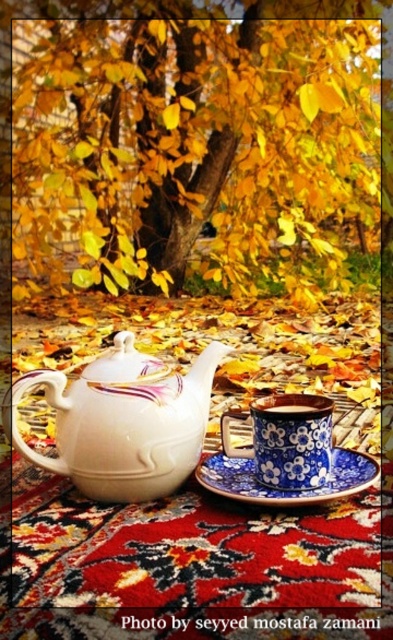
Question: Observing the image, what is the correct spatial positioning of blue ceramic saucer at center in reference to blue glossy mug at center?

Choices:
 (A) left
 (B) right

Answer: (B)

Question: Can you confirm if yellow leaves at upper center is smaller than blue ceramic saucer at center?

Choices:
 (A) no
 (B) yes

Answer: (A)

Question: Which point is closer to the camera?

Choices:
 (A) blue ceramic saucer at center
 (B) yellow leaves at upper center
 (C) blue floral ceramic cup at center

Answer: (A)

Question: Does yellow leaves at upper center have a smaller size compared to blue glossy mug at center?

Choices:
 (A) no
 (B) yes

Answer: (A)

Question: Based on their relative distances, which object is nearer to the blue ceramic cup at center?

Choices:
 (A) white glossy teapot at center
 (B) yellow leaves at upper center
 (C) blue glossy mug at center

Answer: (C)

Question: Which point appears farthest from the camera in this image?

Choices:
 (A) (55, 380)
 (B) (337, 456)

Answer: (B)